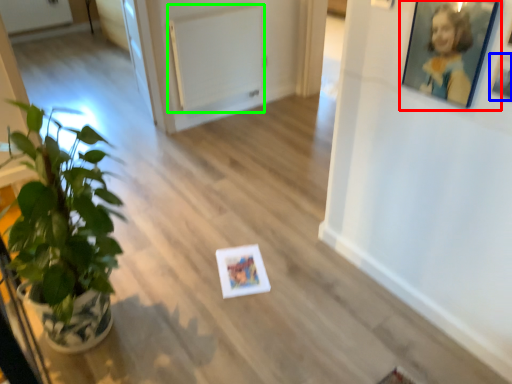
Question: Considering the real-world distances, which object is farthest from picture frame (highlighted by a red box)? picture frame (highlighted by a blue box) or radiator (highlighted by a green box)?

Choices:
 (A) picture frame
 (B) radiator

Answer: (B)